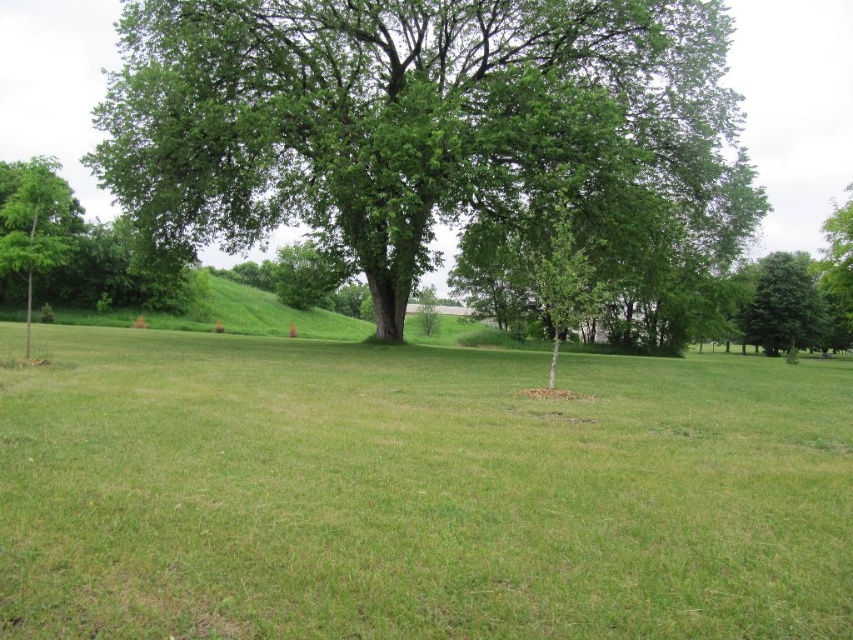
You are standing in the field and want to walk towards the green leafy tree at center and the green leafy tree at left. Which tree will appear closer to you when viewed from your current position?

The green leafy tree at center is above the green leafy tree at left, so when viewed from your current position, the green leafy tree at left will appear closer because it is positioned lower in the field of view.

You are standing in the middle of the green grassy field at center and want to walk towards the green leafy tree at right. Which direction should you head to reach it?

The green leafy tree at right is located above the green grassy field at center, so you should head upwards to reach it.